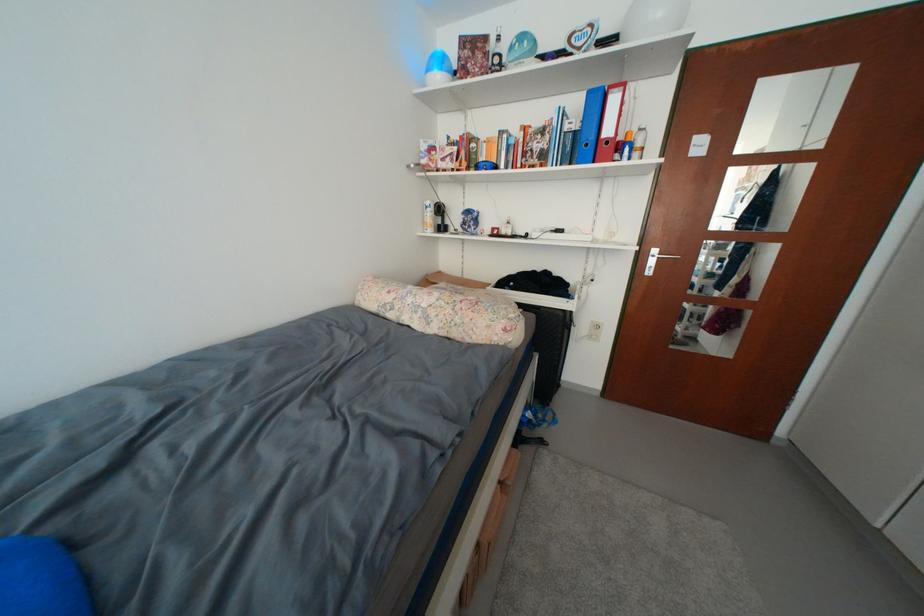
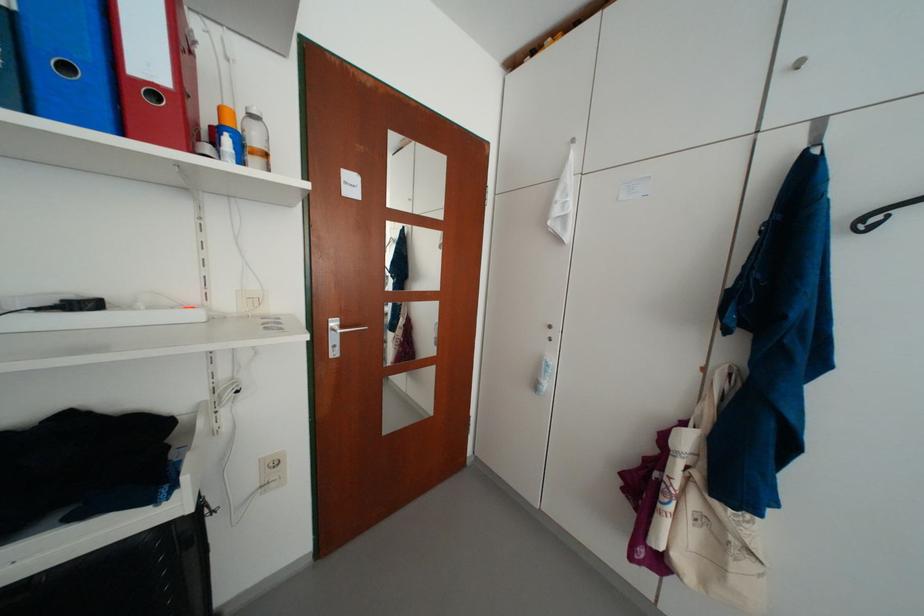
In the second image, find the point that corresponds to (x=609, y=237) in the first image.

(236, 306)